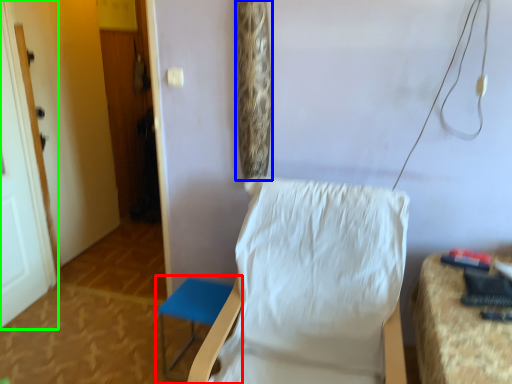
Question: Based on their relative distances, which object is nearer to furniture (highlighted by a red box)? Choose from curtain (highlighted by a blue box) and door (highlighted by a green box).

Choices:
 (A) curtain
 (B) door

Answer: (A)